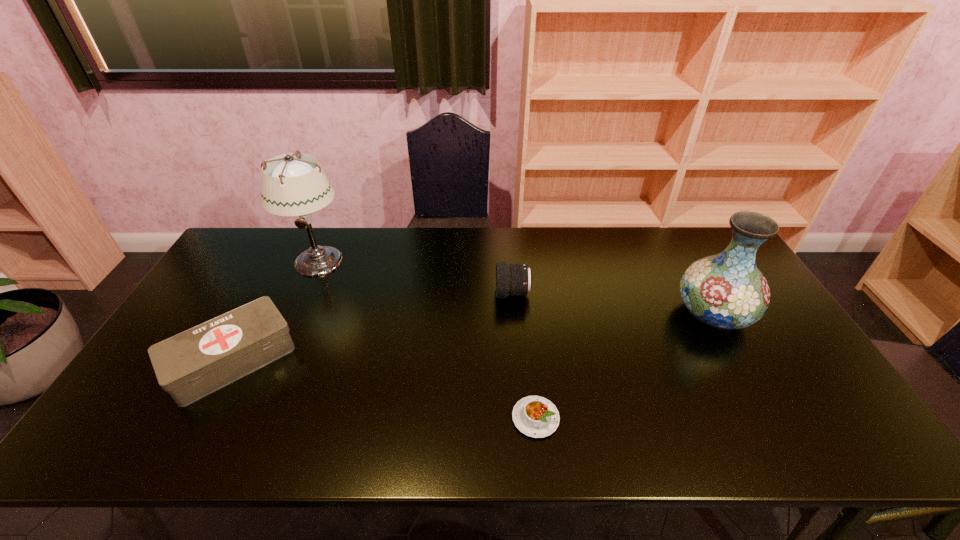
Locate an element on the screen. The image size is (960, 540). empty location between the rightmost object and the first-aid kit is located at coordinates (472, 336).

The height and width of the screenshot is (540, 960). Identify the location of blank region between the telephoto lens and the second shortest object. (372, 327).

Point out which object is positioned as the second nearest to the shortest object. Please provide its 2D coordinates. Your answer should be formatted as a tuple, i.e. [(x, y)], where the tuple contains the x and y coordinates of a point satisfying the conditions above.

[(724, 291)]

Identify which object is the nearest to the first-aid kit. Please provide its 2D coordinates. Your answer should be formatted as a tuple, i.e. [(x, y)], where the tuple contains the x and y coordinates of a point satisfying the conditions above.

[(291, 186)]

Image resolution: width=960 pixels, height=540 pixels. I want to click on free region that satisfies the following two spatial constraints: 1. on the back side of the shortest object; 2. on the right side of the vase, so click(x=524, y=313).

The image size is (960, 540). Identify the location of free spot that satisfies the following two spatial constraints: 1. on the lampshade of the pudding; 2. on the left side of the tallest object. (249, 418).

Where is `vacant area in the image that satisfies the following two spatial constraints: 1. at the front element of the telephoto lens; 2. on the back side of the vase`? The width and height of the screenshot is (960, 540). vacant area in the image that satisfies the following two spatial constraints: 1. at the front element of the telephoto lens; 2. on the back side of the vase is located at coordinates (515, 313).

Where is `free point that satisfies the following two spatial constraints: 1. on the lampshade of the lampshade; 2. on the right side of the fourth shortest object`? This screenshot has width=960, height=540. free point that satisfies the following two spatial constraints: 1. on the lampshade of the lampshade; 2. on the right side of the fourth shortest object is located at coordinates (295, 313).